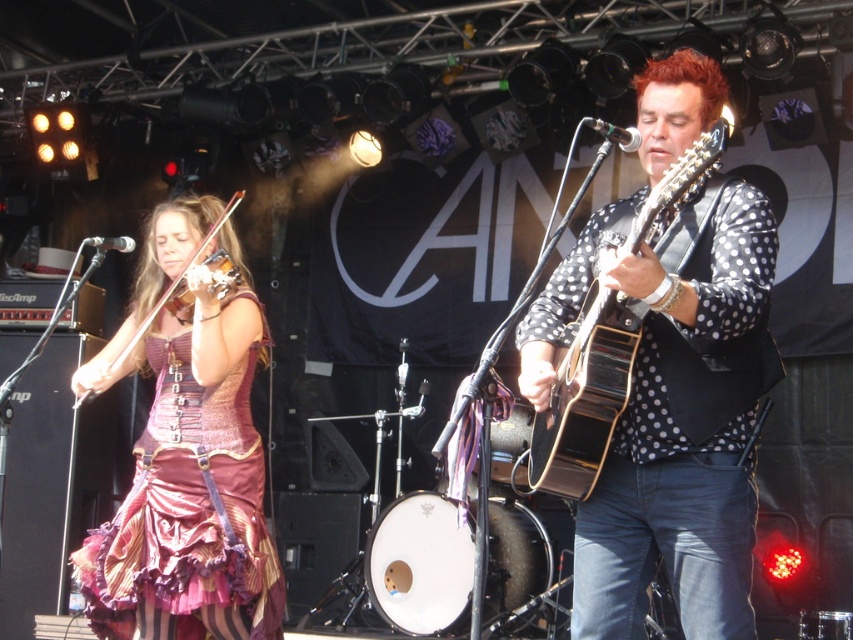
Based on the scene description, where is the shiny purple fabric dress located relative to the point marked at coordinates (189,515)?

The shiny purple fabric dress at left is located at the coordinates point (189,515).

Looking at this image, you are standing at the point marked as point (589,365) in the image. The stage is 5 meters wide. Can you see the entire stage from your current position?

The distance between you and the stage edge is 2.83 meters. Since the stage is 5 meters wide, you can see the entire stage from your current position.

You are a photographer at the concert venue. You want to take a photo of the shiny purple fabric dress at left and the shiny purple violin at left. Which object should you focus on first if you want to capture both in a single frame without moving the camera?

The shiny purple fabric dress at left is much taller than the shiny purple violin at left, so you should focus on the taller dress first to ensure it fits within the frame.